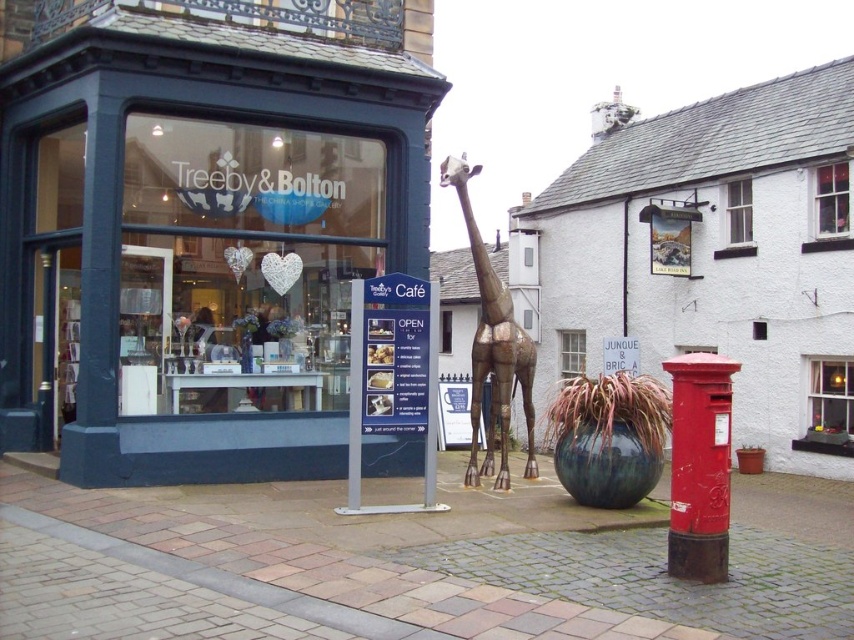
You are standing in front of the shop and want to determine which of the two points, point [218,296] or point [264,150], is closer to you. Based on the scene description, which point is nearer?

Point [218,296] is further to the viewer than point [264,150]. Therefore, point [264,150] is closer to you.

You are a delivery person trying to deliver a package to the matte blue storefront at center. You see the matte glass shop window at center. Is the window part of the storefront, and can you use it to hand over the package?

The matte glass shop window at center is behind the matte blue storefront at center, so the window is part of the storefront. However, since it is a glass window, you cannot physically hand over the package through it. You should look for an entrance or side door instead.